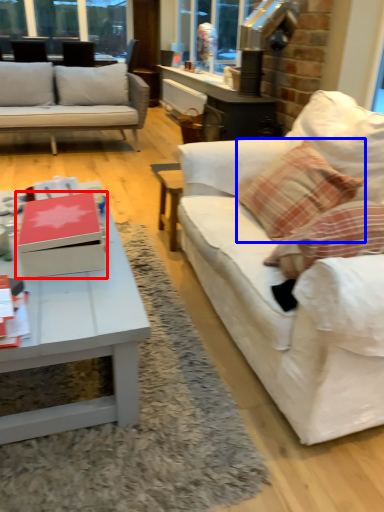
Question: Which point is closer to the camera, box (highlighted by a red box) or throw pillow (highlighted by a blue box)?

Choices:
 (A) box
 (B) throw pillow

Answer: (A)